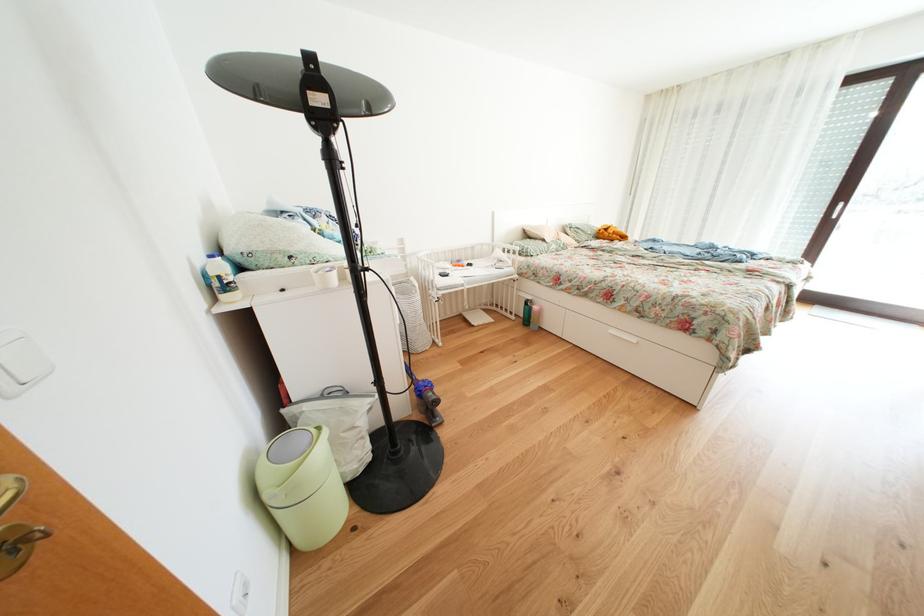
This screenshot has height=616, width=924. Describe the element at coordinates (579, 369) in the screenshot. I see `a white bed drawer handle` at that location.